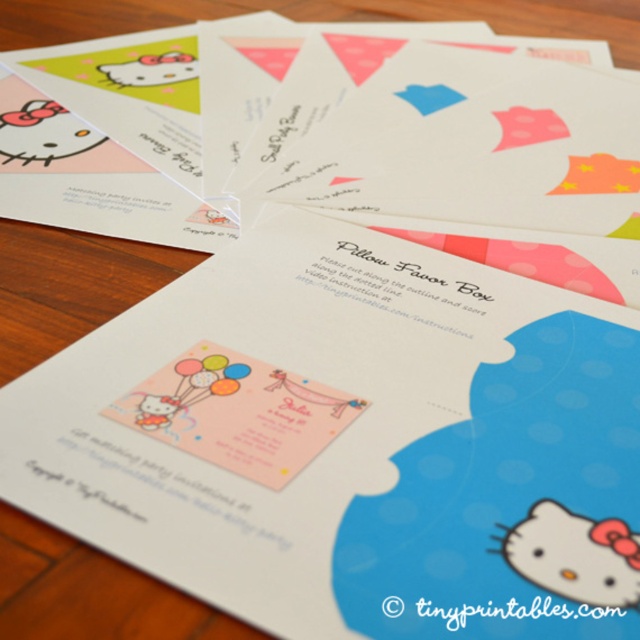
Question: Which object appears closest to the camera in this image?

Choices:
 (A) pink paper card at center
 (B) matte paper invitation at center
 (C) matte pink hello kitty at lower right

Answer: (B)

Question: Which object is closer to the camera taking this photo?

Choices:
 (A) matte pink hello kitty at lower right
 (B) pink paper card at center

Answer: (A)

Question: Is pink paper card at center closer to camera compared to matte pink hello kitty at lower right?

Choices:
 (A) no
 (B) yes

Answer: (A)

Question: Which point is closer to the camera?

Choices:
 (A) (627, 614)
 (B) (168, 388)

Answer: (A)

Question: Does matte paper invitation at center appear on the left side of pink paper card at center?

Choices:
 (A) yes
 (B) no

Answer: (B)

Question: Does pink paper card at center appear over matte pink hello kitty at lower right?

Choices:
 (A) yes
 (B) no

Answer: (A)